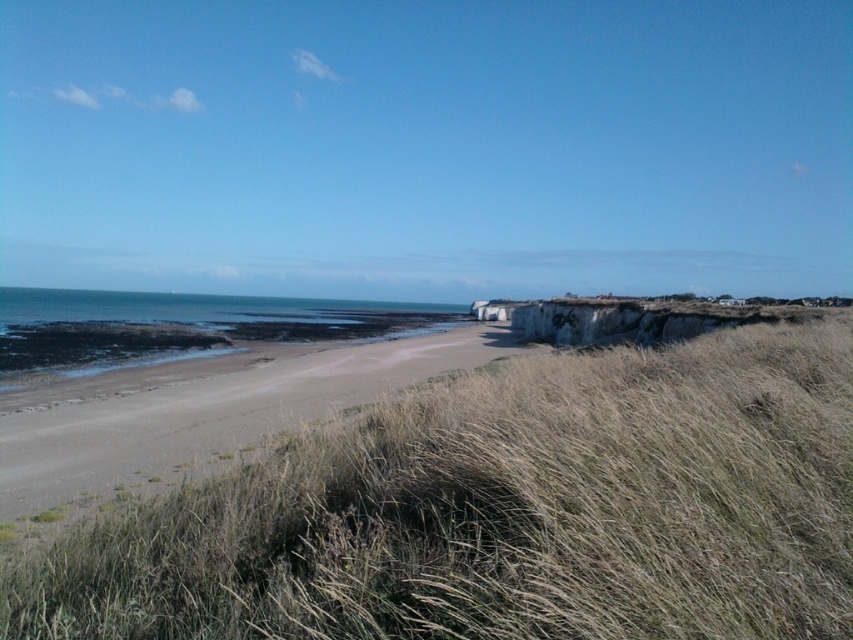
Question: Considering the relative positions of brown sandy beach at center and white stone cliff at right in the image provided, where is brown sandy beach at center located with respect to white stone cliff at right?

Choices:
 (A) below
 (B) above

Answer: (A)

Question: Which point is closer to the camera?

Choices:
 (A) white stone cliff at right
 (B) brown sandy beach at center

Answer: (B)

Question: Which point is farther to the camera?

Choices:
 (A) (581, 330)
 (B) (334, 396)
 (C) (747, 630)

Answer: (A)

Question: From the image, what is the correct spatial relationship of brown sandy beach at center in relation to white stone cliff at right?

Choices:
 (A) above
 (B) below

Answer: (B)

Question: Which point is closer to the camera taking this photo?

Choices:
 (A) (86, 339)
 (B) (524, 333)
 (C) (419, 380)
 (D) (192, 518)

Answer: (D)

Question: Is brown sandy beach at center smaller than white stone cliff at right?

Choices:
 (A) no
 (B) yes

Answer: (B)